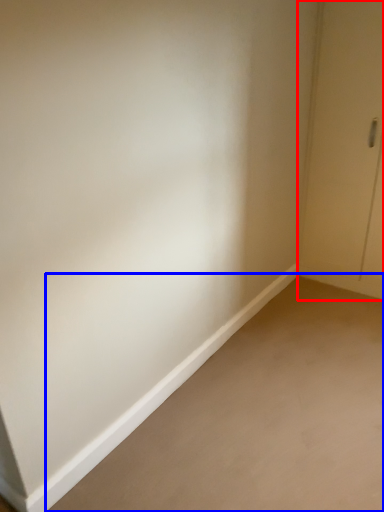
Question: Which object appears farthest to the camera in this image, door (highlighted by a red box) or plain (highlighted by a blue box)?

Choices:
 (A) door
 (B) plain

Answer: (A)